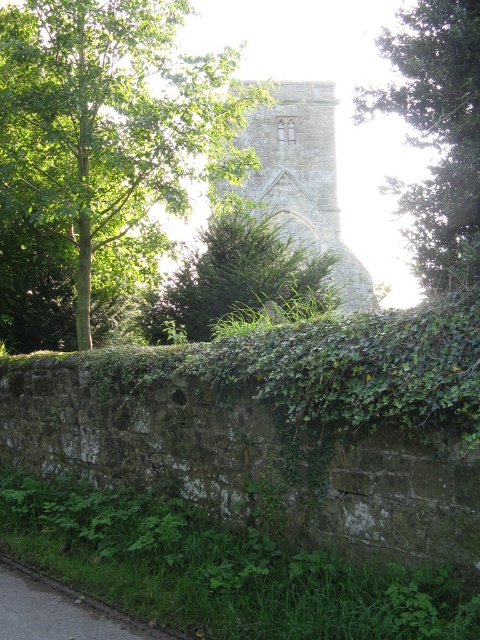
Is green leafy tree at left to the left of gray asphalt path at lower left from the viewer's perspective?

Correct, you'll find green leafy tree at left to the left of gray asphalt path at lower left.

Find the location of `green leafy tree at left`. green leafy tree at left is located at coordinates (111, 124).

Find the location of a particular element. This screenshot has width=480, height=640. green leafy tree at left is located at coordinates (111, 124).

Does green leafy tree at upper center have a greater width compared to stone tower at center?

Yes, green leafy tree at upper center is wider than stone tower at center.

Does green leafy tree at upper center have a greater height compared to stone tower at center?

Indeed, green leafy tree at upper center has a greater height compared to stone tower at center.

Who is more forward, [430,38] or [298,243]?

Positioned in front is point [430,38].

Locate an element on the screen. green leafy tree at upper center is located at coordinates (436, 134).

The height and width of the screenshot is (640, 480). What do you see at coordinates (436, 134) in the screenshot?
I see `green leafy tree at upper center` at bounding box center [436, 134].

Does green leafy tree at upper center have a lesser height compared to green leafy hedge at center?

No, green leafy tree at upper center is not shorter than green leafy hedge at center.

Who is more distant from viewer, (458, 116) or (296, 269)?

Point (296, 269)

The height and width of the screenshot is (640, 480). I want to click on green leafy tree at upper center, so click(436, 134).